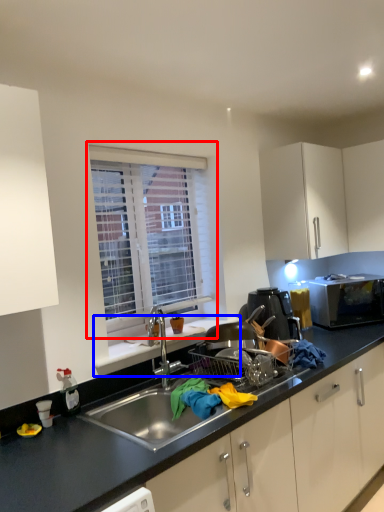
Question: Which object is closer to the camera taking this photo, window (highlighted by a red box) or window sill (highlighted by a blue box)?

Choices:
 (A) window
 (B) window sill

Answer: (B)